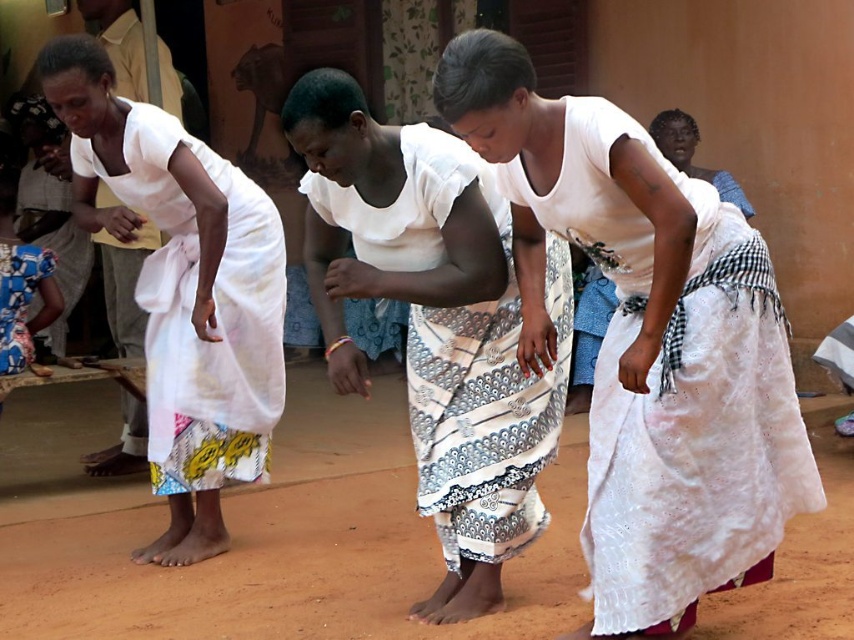
You are standing in the scene and want to place a small decoration between the point at (771,490) and the point at (41,291). Which point should the decoration be closer to so it appears larger in the image?

The decoration should be placed closer to point (771,490) because it is closer to the viewer, making objects placed there appear larger in the image.

You are a photographer trying to capture the cultural dance scene. You notice a point marked at coordinates (646, 342) in the image. What object is located at this point?

The point at coordinates (646, 342) indicates the location of the white textured cloth at center.

You are a photographer trying to capture the scene of the women dancing. You want to include the white woven cloth at left in your shot. Where should you position yourself relative to the cloth to ensure it appears in the frame?

To include the white woven cloth at left in your photo, position yourself so that the cloth is within your camera frame. Since the cloth is located at coordinates point [183,291], align your camera to capture that area.